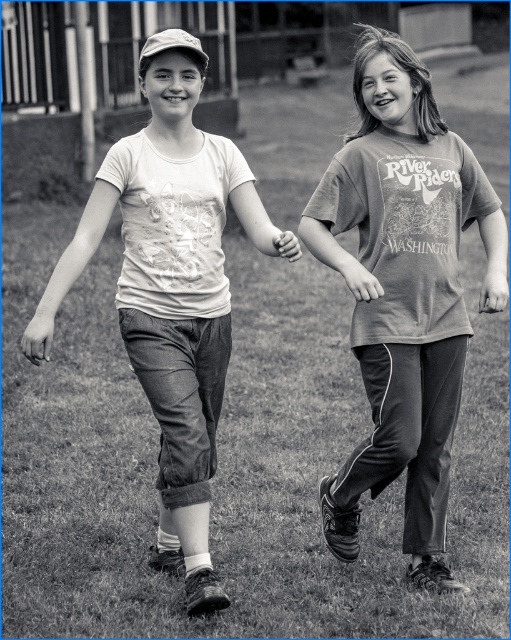
Can you confirm if grassy lawn at center is positioned above smooth skin hand at center?

No.

Who is taller, grassy lawn at center or smooth skin hand at center?

With more height is smooth skin hand at center.

The height and width of the screenshot is (640, 511). What are the coordinates of `grassy lawn at center` in the screenshot? It's located at (225, 465).

Find the location of a particular element. grassy lawn at center is located at coordinates (225, 465).

Can you confirm if grassy lawn at center is positioned below printed cotton t-shirt at right?

Yes, grassy lawn at center is below printed cotton t-shirt at right.

Which is in front, point (401, 493) or point (455, 196)?

Point (455, 196) is more forward.

Does point (132, 589) come closer to viewer compared to point (387, 301)?

No, it is not.

Locate an element on the screen. Image resolution: width=511 pixels, height=640 pixels. grassy lawn at center is located at coordinates (225, 465).

Does grassy lawn at center appear under matte white t-shirt at center?

Yes, grassy lawn at center is below matte white t-shirt at center.

Can you confirm if grassy lawn at center is positioned to the right of matte white t-shirt at center?

Yes, grassy lawn at center is to the right of matte white t-shirt at center.

Identify the location of grassy lawn at center. The image size is (511, 640). (225, 465).